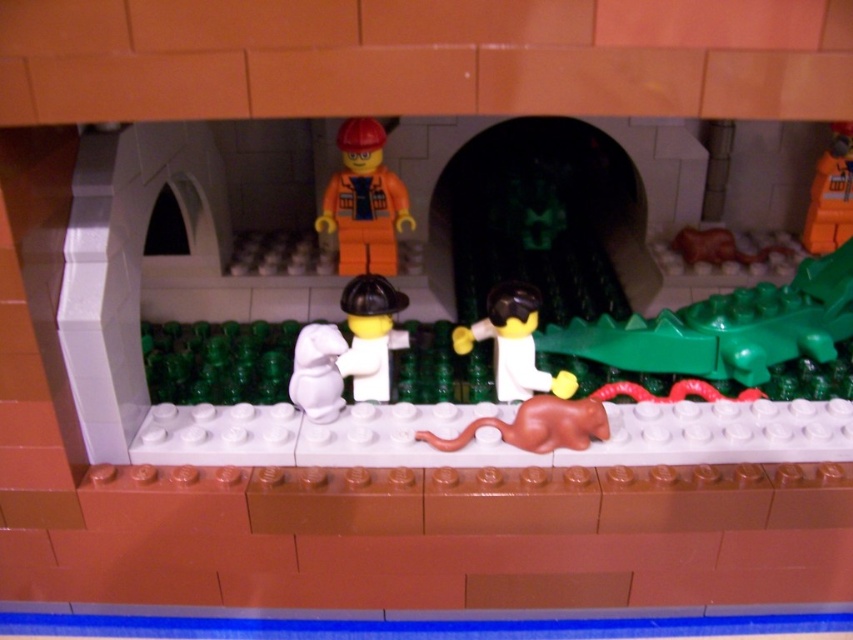
Based on the scene description, where is the orange matte construction worker at center located in terms of coordinates?

The orange matte construction worker at center is located at point coordinates of (364, 202).

From the picture: In the LEGO diorama, there is an orange matte construction worker at center and a white matte mouse at center. Which one is located to the right of the other?

The orange matte construction worker at center is positioned on the right side of white matte mouse at center.

You are navigating through the LEGO tunnel scene. There are two points marked in the image. From your perspective, which point is closer to you? The points are labeled as point (383, 298) and point (585, 426).

Point (585, 426) is closer to you because the description states that point (383, 298) is behind point (585, 426).